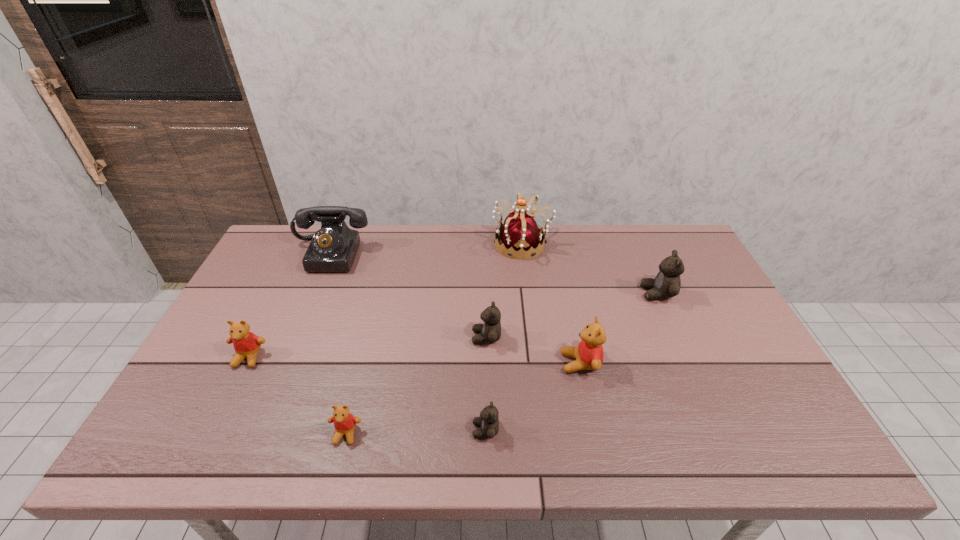
The height and width of the screenshot is (540, 960). Identify the location of tiara that is positioned at the far edge. (520, 236).

Identify the location of telephone that is at the far edge. The height and width of the screenshot is (540, 960). (333, 248).

The height and width of the screenshot is (540, 960). I want to click on telephone that is at the left edge, so click(x=333, y=248).

Locate an element on the screen. The width and height of the screenshot is (960, 540). teddy bear located in the left edge section of the desktop is located at coordinates (246, 344).

Locate an element on the screen. This screenshot has height=540, width=960. object at the right edge is located at coordinates (667, 283).

Locate an element on the screen. The height and width of the screenshot is (540, 960). object that is at the far left corner is located at coordinates (333, 248).

This screenshot has height=540, width=960. I want to click on blank space at the far edge, so click(x=617, y=231).

Image resolution: width=960 pixels, height=540 pixels. In the image, there is a desktop. What are the coordinates of `vacant space at the near edge` in the screenshot? It's located at (649, 426).

The image size is (960, 540). Find the location of `vacant space at the left edge`. vacant space at the left edge is located at coordinates (265, 353).

This screenshot has height=540, width=960. In the image, there is a desktop. Find the location of `vacant space at the right edge`. vacant space at the right edge is located at coordinates (707, 321).